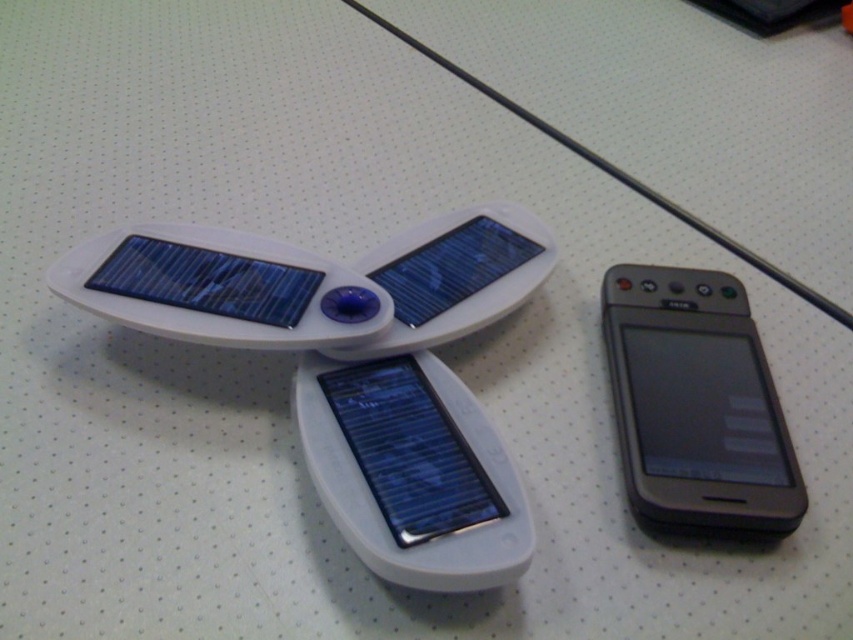
Does black matte smartphone at right come behind slate gray metallic smartphone at center?

Yes, it is behind slate gray metallic smartphone at center.

Locate an element on the screen. The height and width of the screenshot is (640, 853). black matte smartphone at right is located at coordinates (695, 403).